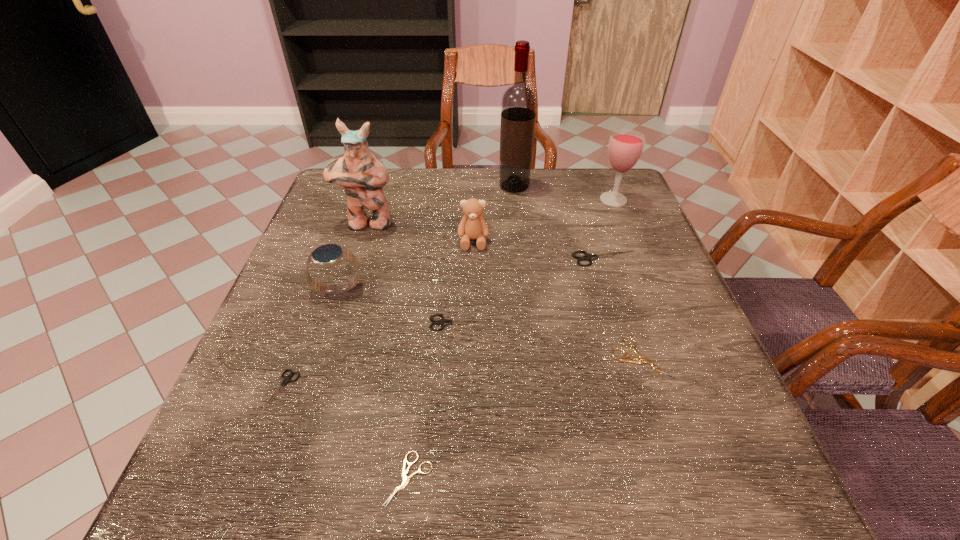
Image resolution: width=960 pixels, height=540 pixels. In order to click on vacant space at the near left corner of the desktop in this screenshot , I will do `click(230, 507)`.

At what (x,y) coordinates should I click in order to perform the action: click on vacant space at the near right corner. Please return your answer as a coordinate pair (x, y). The width and height of the screenshot is (960, 540). Looking at the image, I should click on click(x=707, y=481).

The height and width of the screenshot is (540, 960). I want to click on unoccupied position between the nearest shears and the wineglass, so click(511, 339).

Where is `free space between the fifth nearest object and the left beige shears`? free space between the fifth nearest object and the left beige shears is located at coordinates pyautogui.click(x=373, y=384).

The image size is (960, 540). Identify the location of unoccupied area between the smallest black shears and the farther beige shears. (461, 375).

Where is `free space between the left beige shears and the farther beige shears`? This screenshot has height=540, width=960. free space between the left beige shears and the farther beige shears is located at coordinates (525, 419).

Find the location of a particular element. The width and height of the screenshot is (960, 540). free spot between the bigger beige shears and the pink figurine is located at coordinates (504, 291).

Where is `vacant region between the tallest shears and the wineglass`? This screenshot has height=540, width=960. vacant region between the tallest shears and the wineglass is located at coordinates (610, 229).

You are a GUI agent. You are given a task and a screenshot of the screen. Output one action in this format:
    pyautogui.click(x=<x>, y=<y>)
    Task: Click on the vacant point located between the watch and the teddy bear
    The image size is (960, 540).
    Given the screenshot: What is the action you would take?
    pyautogui.click(x=406, y=265)

At what (x,y) coordinates should I click in order to perform the action: click on free space between the leftmost shears and the bigger beige shears. Please return your answer as a coordinate pair (x, y). The width and height of the screenshot is (960, 540). Looking at the image, I should click on (461, 375).